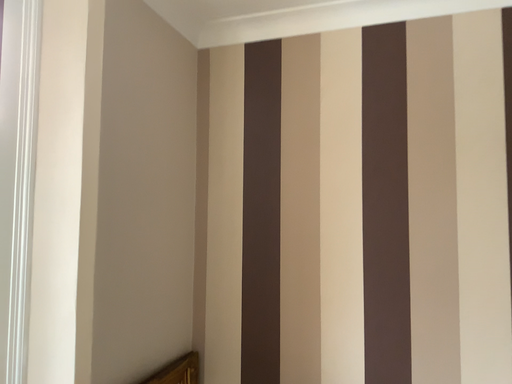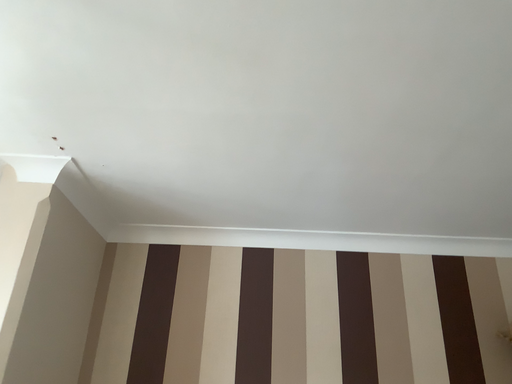
Question: Which way did the camera rotate in the video?

Choices:
 (A) rotated upward
 (B) rotated downward

Answer: (A)